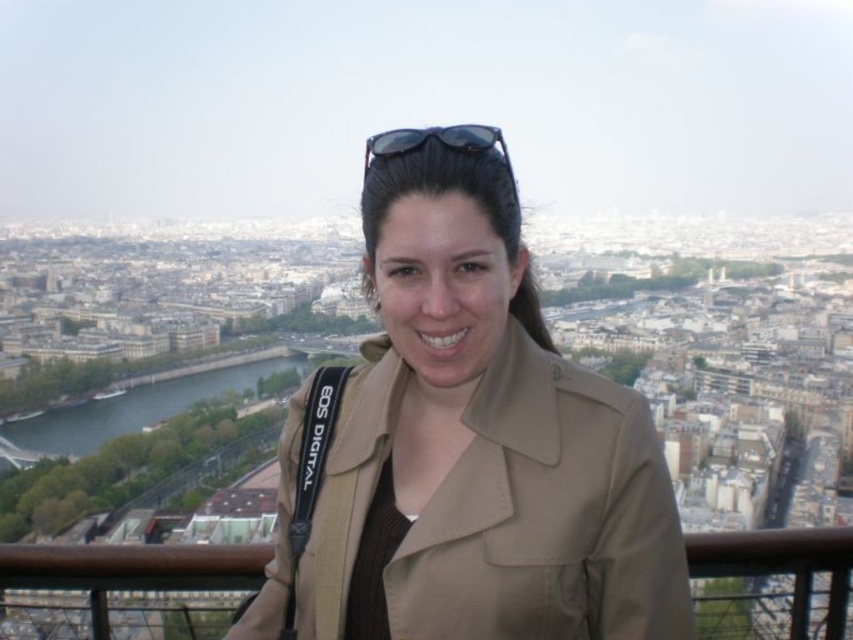
Can you confirm if tan fabric jacket at center is taller than sunglasses at center?

No, tan fabric jacket at center is not taller than sunglasses at center.

Who is more distant from viewer, (500, 568) or (469, 129)?

Positioned behind is point (469, 129).

I want to click on tan fabric jacket at center, so click(471, 449).